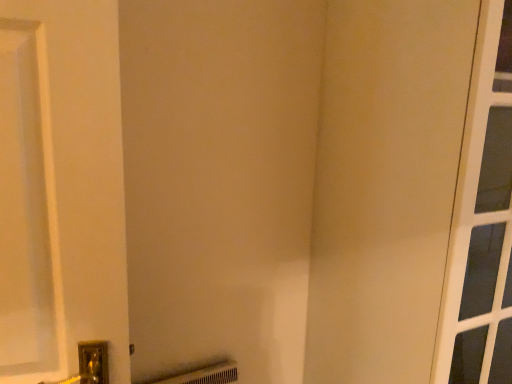
Find the location of `matte white screen door at right`. matte white screen door at right is located at coordinates (385, 185).

This screenshot has height=384, width=512. What do you see at coordinates (385, 185) in the screenshot? I see `matte white screen door at right` at bounding box center [385, 185].

Where is `matte white screen door at right`? Image resolution: width=512 pixels, height=384 pixels. matte white screen door at right is located at coordinates (385, 185).